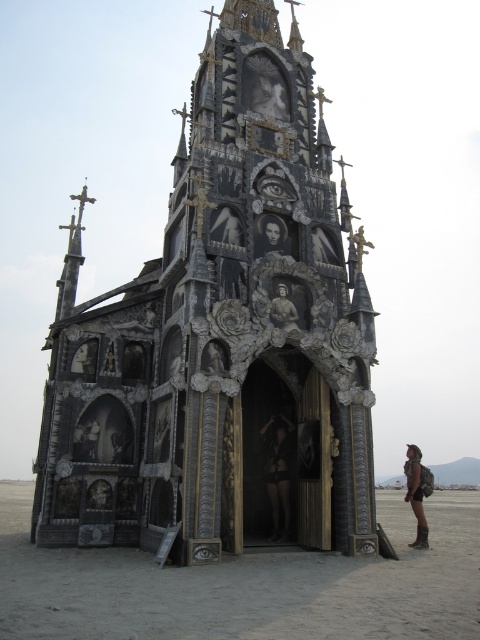
Question: Which object is farther from the camera taking this photo?

Choices:
 (A) black wood church at center
 (B) smooth bronze statue at center
 (C) smooth black portrait at center
 (D) black leather pants at center

Answer: (C)

Question: Is black leather pants at center in front of camouflage fabric backpack at lower right?

Choices:
 (A) no
 (B) yes

Answer: (B)

Question: Is black leather pants at center wider than smooth black portrait at center?

Choices:
 (A) yes
 (B) no

Answer: (B)

Question: Which object is positioned closest to the black leather pants at center?

Choices:
 (A) smooth bronze statue at center
 (B) camouflage fabric backpack at lower right
 (C) smooth black portrait at center
 (D) black wood church at center

Answer: (B)

Question: Is black wood church at center smaller than smooth black portrait at center?

Choices:
 (A) no
 (B) yes

Answer: (A)

Question: Which of the following is the closest to the observer?

Choices:
 (A) black wood church at center
 (B) camouflage fabric backpack at lower right
 (C) smooth black portrait at center

Answer: (A)